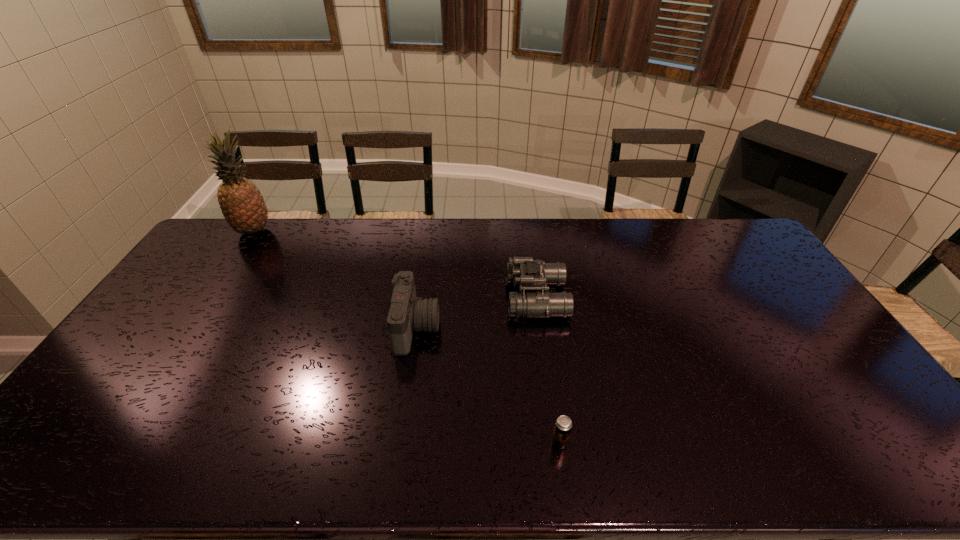
This screenshot has width=960, height=540. What are the coordinates of `the leftmost object` in the screenshot? It's located at (243, 206).

Where is `pineapple`? pineapple is located at coordinates (243, 206).

Identify the location of the third object from right to left. This screenshot has width=960, height=540. (407, 312).

At what (x,y) coordinates should I click in order to perform the action: click on binoculars. Please return your answer as a coordinate pair (x, y). The height and width of the screenshot is (540, 960). Looking at the image, I should click on (529, 274).

What are the coordinates of `beer can` in the screenshot? It's located at coord(563,425).

In order to click on the nearest object in this screenshot , I will do (x=563, y=425).

Locate an element on the screen. The width and height of the screenshot is (960, 540). vacant space located on the right of the leftmost object is located at coordinates (297, 231).

The height and width of the screenshot is (540, 960). In order to click on vacant space located at the lens of the third object from right to left in this screenshot , I will do `click(485, 328)`.

The height and width of the screenshot is (540, 960). Identify the location of blank space located through the lenses of the binoculars. 458,298.

You are a GUI agent. You are given a task and a screenshot of the screen. Output one action in this format:
    pyautogui.click(x=<x>, y=<y>)
    Task: Click on the vacant space situated 0.360m through the lenses of the binoculars
    The width and height of the screenshot is (960, 540).
    Given the screenshot: What is the action you would take?
    pyautogui.click(x=396, y=298)